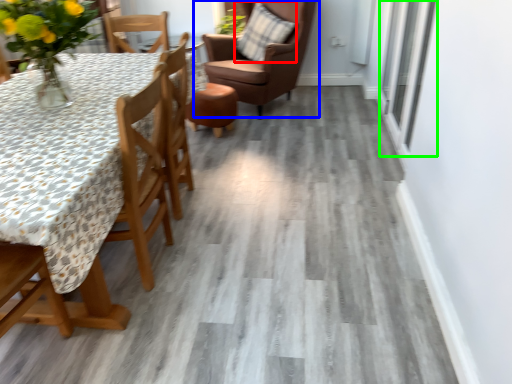
Question: Which is nearer to the pillow (highlighted by a red box)? chair (highlighted by a blue box) or window (highlighted by a green box).

Choices:
 (A) chair
 (B) window

Answer: (A)